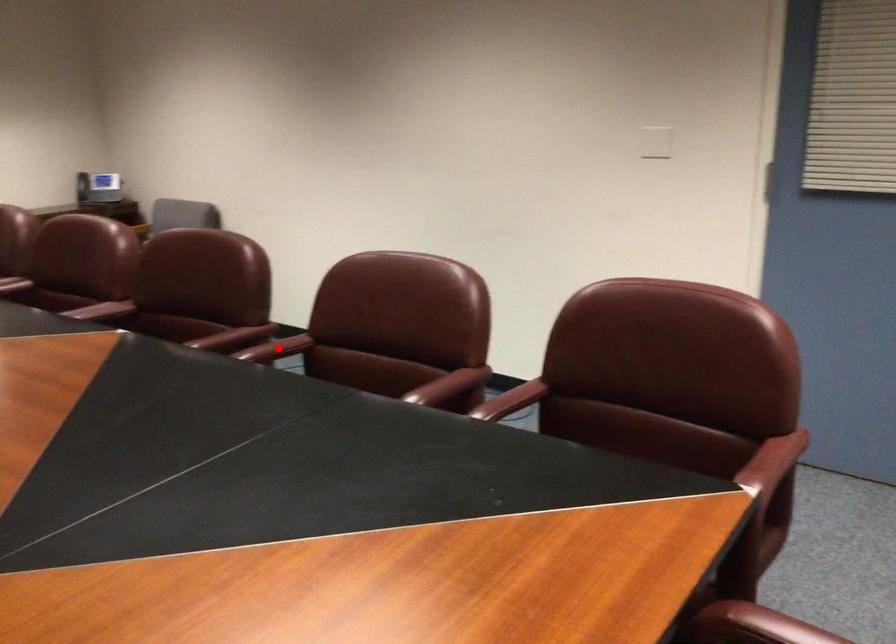
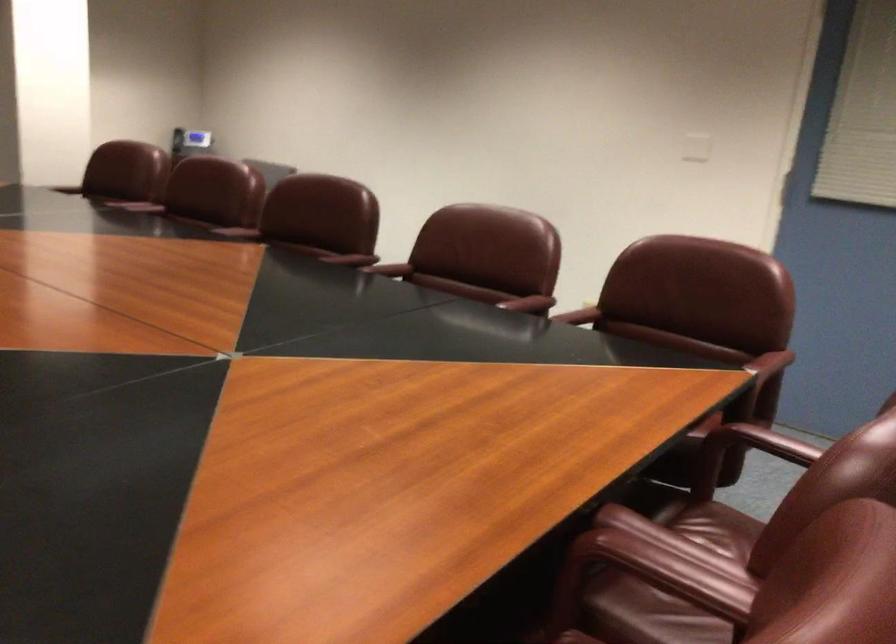
Find the pixel in the second image that matches the highlighted location in the first image.

(390, 269)